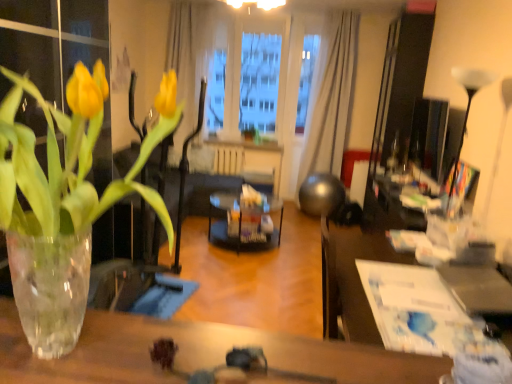
Question: From the image's perspective, is white sheer curtain at upper center above or below transparent glass table at lower center, the 1th table when ordered from front to back?

Choices:
 (A) below
 (B) above

Answer: (B)

Question: From a real-world perspective, is white sheer curtain at upper center physically located above or below transparent glass table at lower center, which appears as the 1th table when viewed from the left?

Choices:
 (A) above
 (B) below

Answer: (A)

Question: Considering the real-world distances, which object is farthest from the black glass table at center?

Choices:
 (A) white sheer curtain at upper center
 (B) translucent glass vase at left
 (C) transparent plastic window screen at center
 (D) white paper at center, which is counted as the 1th table, starting from the right
 (E) transparent glass table at lower center, the 1th table when ordered from front to back

Answer: (E)

Question: Which of these objects is positioned closest to the white sheer curtain at upper center?

Choices:
 (A) white glossy lamp at upper right
 (B) translucent glass vase at left
 (C) transparent glass table at lower center, the 2th table from the right
 (D) transparent plastic window screen at center
 (E) black glass table at center

Answer: (D)